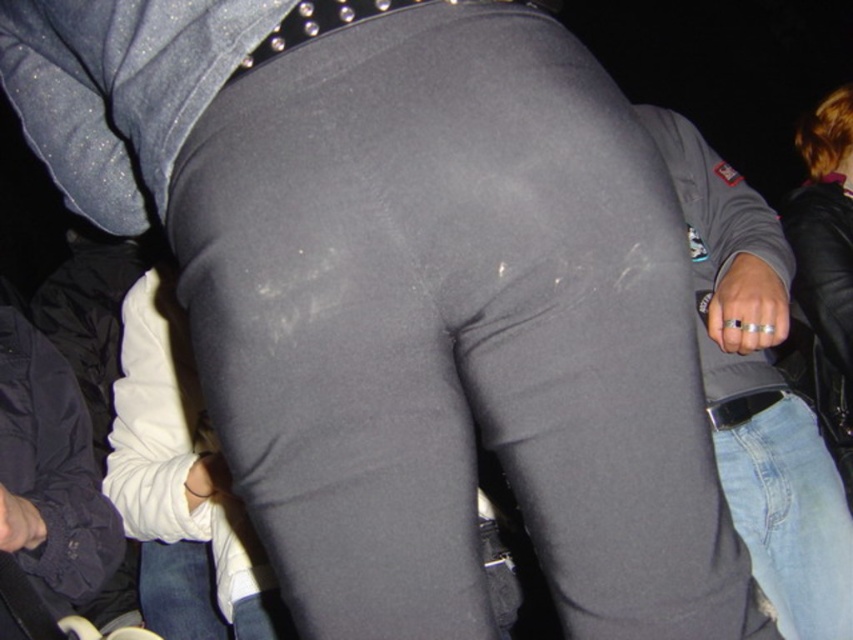
Is gray matte leggings at center further to the viewer compared to gray matte pants at center?

No, gray matte leggings at center is closer to the viewer.

I want to click on gray matte leggings at center, so click(453, 330).

Between point (387, 38) and point (120, 486), which one is positioned behind?

The point (120, 486) is behind.

At what (x,y) coordinates should I click in order to perform the action: click on gray matte leggings at center. Please return your answer as a coordinate pair (x, y). The image size is (853, 640). Looking at the image, I should click on (453, 330).

Which is in front, point (218, 548) or point (71, 467)?

Positioned in front is point (71, 467).

Does gray matte pants at center have a lesser height compared to dark blue fabric pants at lower left?

No.

The width and height of the screenshot is (853, 640). Identify the location of gray matte pants at center. (181, 486).

Which of these two, light blue denim jeans at lower right or jeans at lower left, stands shorter?

jeans at lower left is shorter.

Can you confirm if light blue denim jeans at lower right is positioned below jeans at lower left?

Incorrect, light blue denim jeans at lower right is not positioned below jeans at lower left.

Between point (799, 616) and point (254, 632), which one is positioned behind?

Positioned behind is point (799, 616).

Identify the location of light blue denim jeans at lower right. The height and width of the screenshot is (640, 853). 787,509.